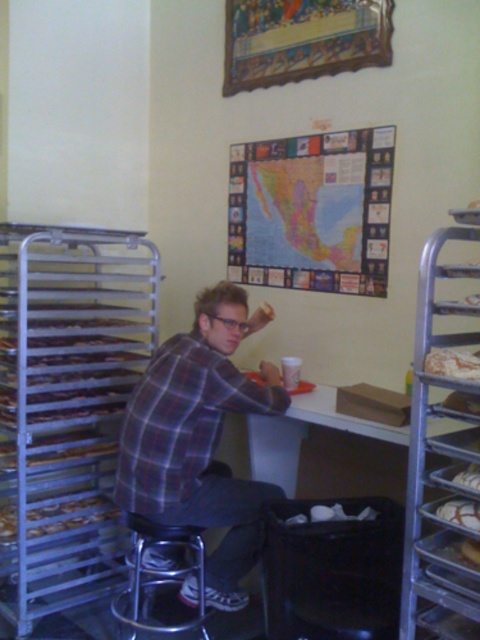
Which is behind, point (149, 512) or point (477, 550)?

The point (149, 512) is behind.

Locate an element on the screen. This screenshot has width=480, height=640. plaid shirt at center is located at coordinates (200, 436).

Locate an element on the screen. plaid shirt at center is located at coordinates (200, 436).

Does white matte table at center have a greater height compared to white glossy bread at right?

Yes.

This screenshot has width=480, height=640. What do you see at coordinates (302, 435) in the screenshot?
I see `white matte table at center` at bounding box center [302, 435].

Identify the location of white matte table at center. The height and width of the screenshot is (640, 480). (302, 435).

Is white matte table at center above brown matte bread at center?

Yes, white matte table at center is above brown matte bread at center.

Who is higher up, white matte table at center or brown matte bread at center?

Positioned higher is white matte table at center.

Between point (350, 429) and point (472, 548), which one is positioned behind?

The point (350, 429) is behind.

Find the location of `white matte table at center`. white matte table at center is located at coordinates (302, 435).